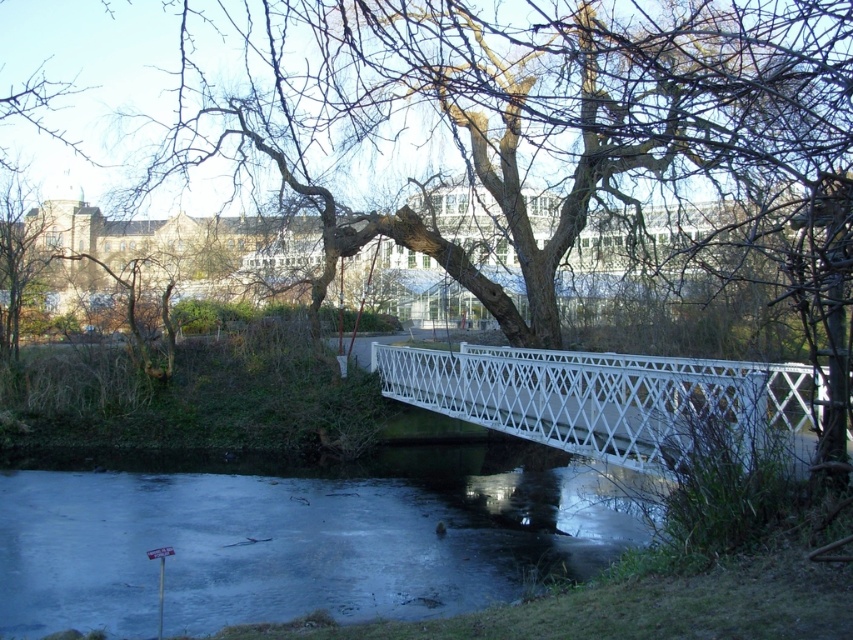
Between frozen ice at lower center and white lattice bridge at center, which one appears on the right side from the viewer's perspective?

Positioned to the right is white lattice bridge at center.

Locate an element on the screen. This screenshot has width=853, height=640. frozen ice at lower center is located at coordinates pos(305,538).

I want to click on frozen ice at lower center, so point(305,538).

The height and width of the screenshot is (640, 853). I want to click on frozen ice at lower center, so click(x=305, y=538).